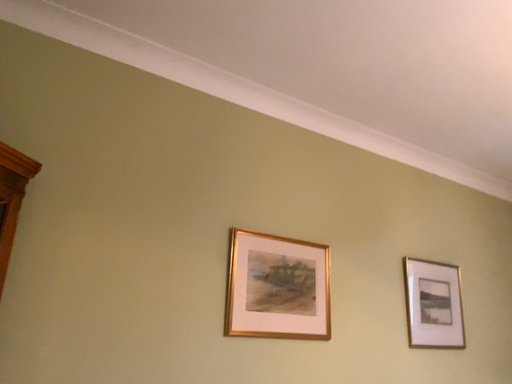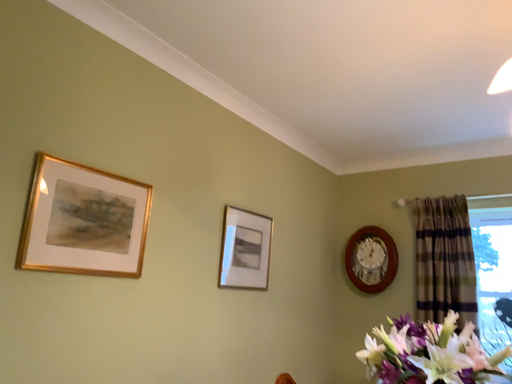
Question: How did the camera likely rotate when shooting the video?

Choices:
 (A) rotated upward
 (B) rotated downward

Answer: (B)